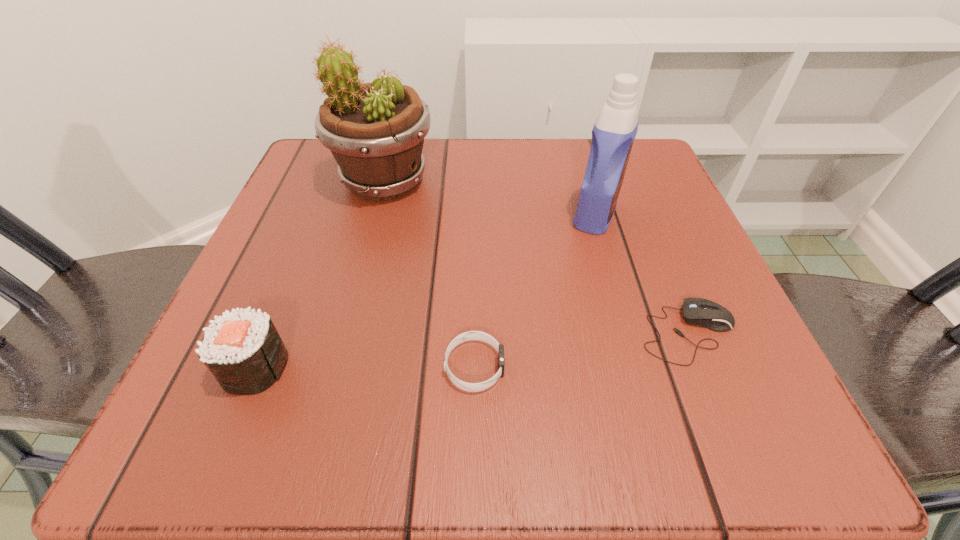
In order to click on flowerpot at the far edge in this screenshot , I will do `click(375, 131)`.

Where is `detergent that is positioned at the far edge`? This screenshot has width=960, height=540. detergent that is positioned at the far edge is located at coordinates (613, 134).

Where is `sushi at the near edge`? sushi at the near edge is located at coordinates 244,352.

Where is `wristband that is positioned at the near edge`? wristband that is positioned at the near edge is located at coordinates pos(471,335).

What are the coordinates of `flowerpot that is at the left edge` in the screenshot? It's located at (375, 131).

Where is `sushi located in the left edge section of the desktop`? This screenshot has width=960, height=540. sushi located in the left edge section of the desktop is located at coordinates (244, 352).

Where is `detergent that is at the right edge`? This screenshot has width=960, height=540. detergent that is at the right edge is located at coordinates (613, 134).

The image size is (960, 540). Find the location of `computer mouse at the right edge`. computer mouse at the right edge is located at coordinates (697, 311).

You are a GUI agent. You are given a task and a screenshot of the screen. Output one action in this format:
    pyautogui.click(x=<x>, y=<y>)
    Task: Click on the object located in the far left corner section of the desktop
    
    Given the screenshot: What is the action you would take?
    pyautogui.click(x=375, y=131)

Locate an element on the screen. Image resolution: width=960 pixels, height=540 pixels. object that is at the near left corner is located at coordinates (244, 352).